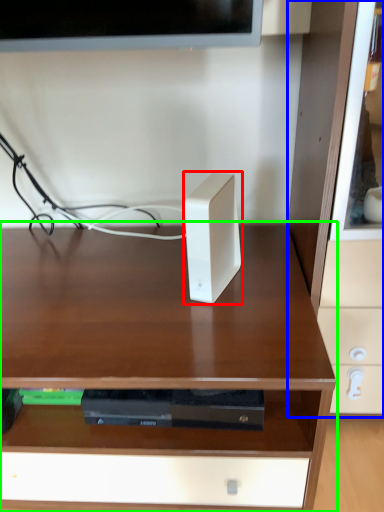
Question: Which is nearer to the ipod (highlighted by a red box)? dresser (highlighted by a blue box) or desk (highlighted by a green box).

Choices:
 (A) dresser
 (B) desk

Answer: (B)